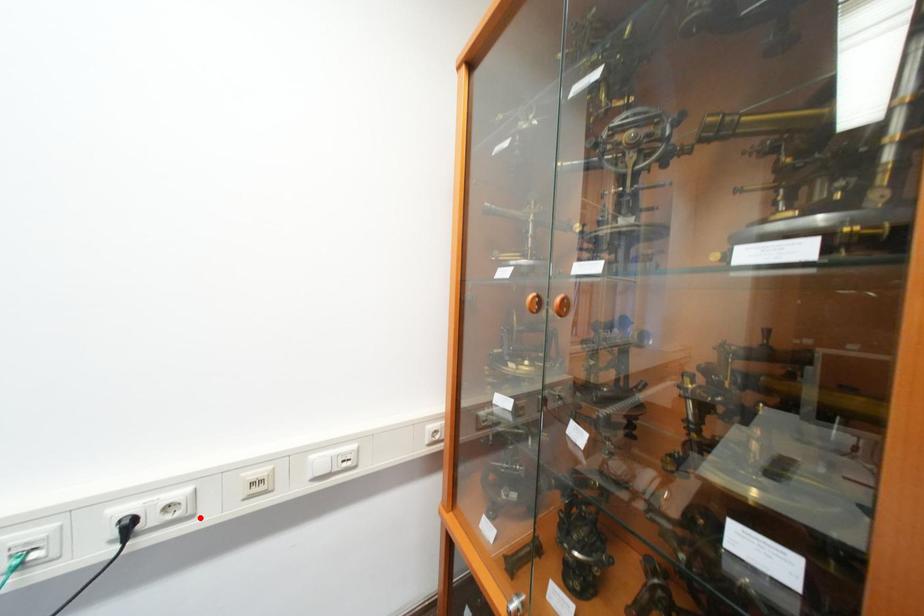
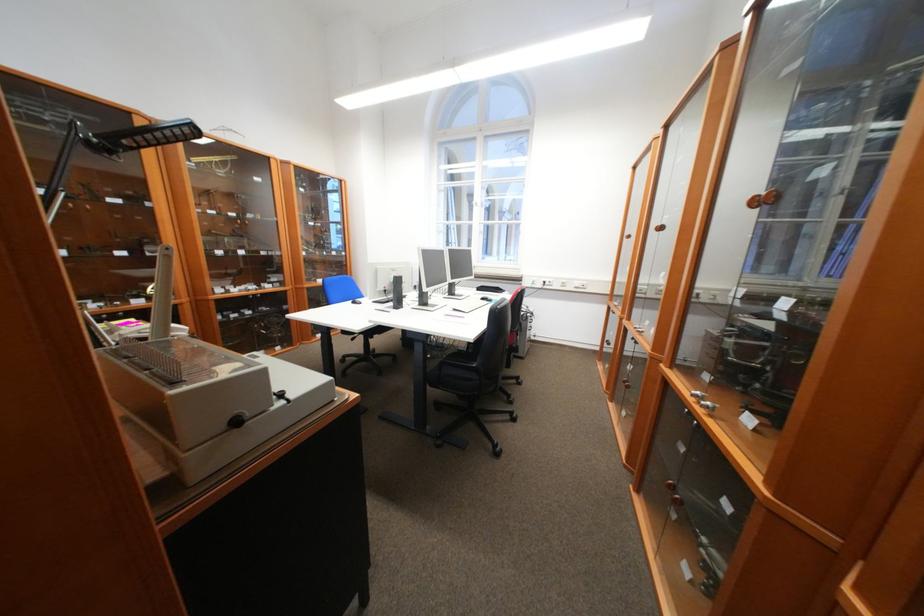
Find the pixel in the second image that matches the highlighted location in the first image.

(562, 286)